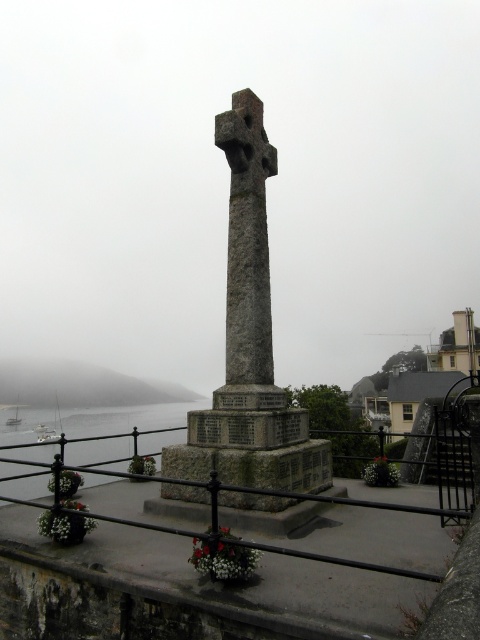
Who is shorter, granite cross at center or gray stone cross at center?

gray stone cross at center

Which is behind, point (264, 202) or point (220, 115)?

Point (264, 202)

Between point (259, 474) and point (228, 317), which one is positioned behind?

The point (228, 317) is more distant.

Image resolution: width=480 pixels, height=640 pixels. I want to click on granite cross at center, so click(x=249, y=342).

From the picture: Is clear water at lower left closer to the viewer compared to foggy gray hillside at lower left?

Yes.

Can you confirm if clear water at lower left is thinner than foggy gray hillside at lower left?

No.

Locate an element on the screen. clear water at lower left is located at coordinates (126, 419).

Does rustic stone ledge at center have a lesser height compared to clear water at lower left?

Indeed, rustic stone ledge at center has a lesser height compared to clear water at lower left.

Does rustic stone ledge at center appear on the right side of clear water at lower left?

Correct, you'll find rustic stone ledge at center to the right of clear water at lower left.

Locate an element on the screen. rustic stone ledge at center is located at coordinates (215, 592).